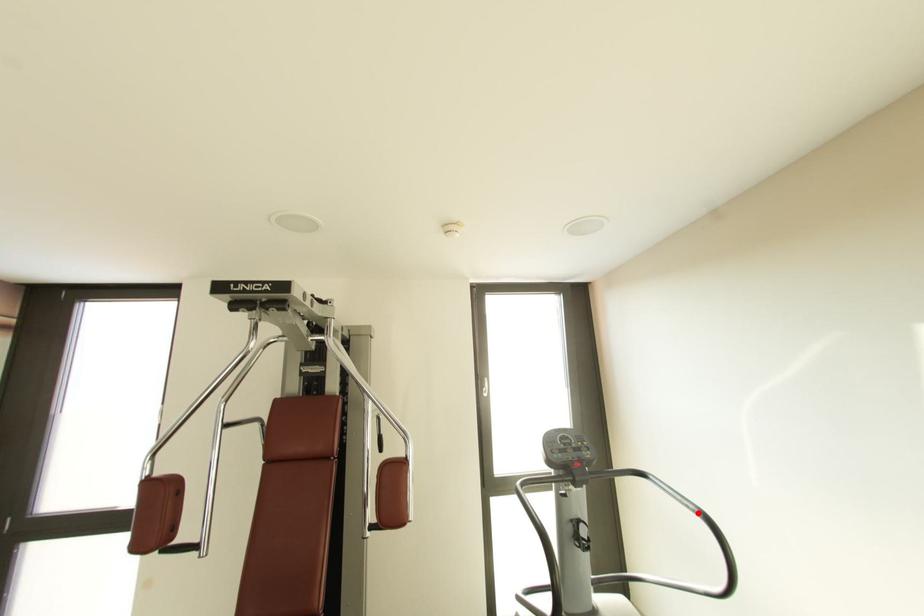
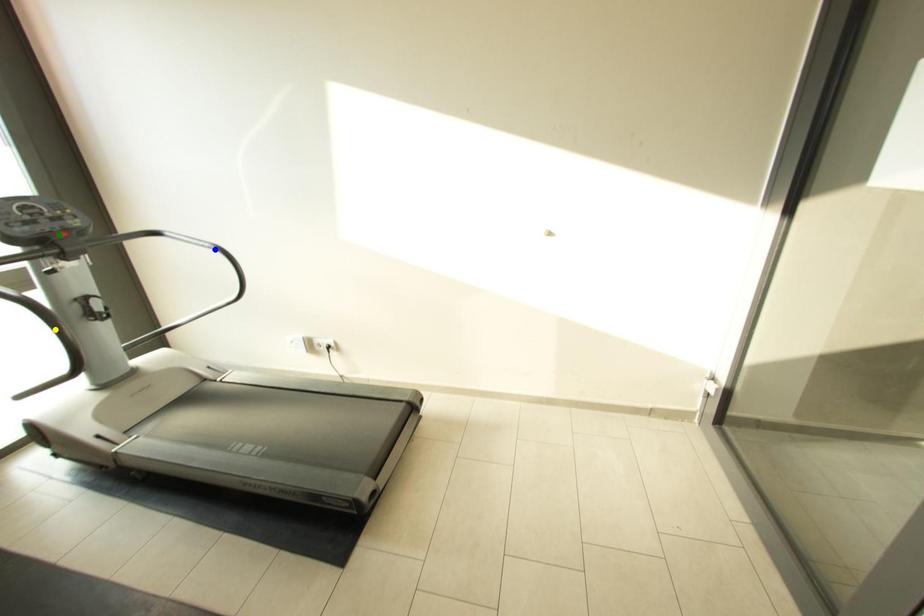
Question: I am providing you with two images of the same scene from different viewpoints. A red point is marked on the first image. You are given multiple points on the second image. Which mark in image 2 goes with the point in image 1?

Choices:
 (A) green point
 (B) yellow point
 (C) blue point

Answer: (C)